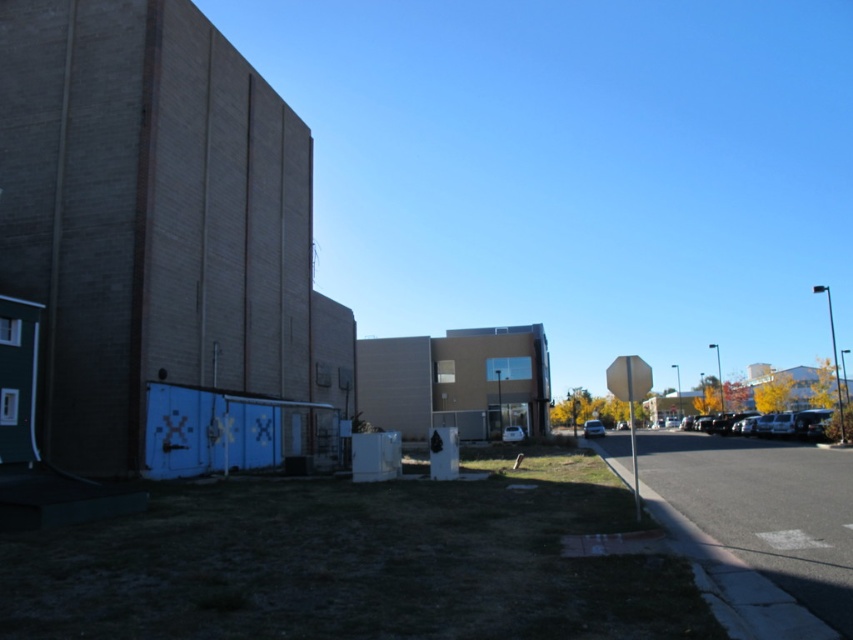
Question: Is metallic silver car at center above shiny silver sedan at center?

Choices:
 (A) no
 (B) yes

Answer: (B)

Question: Which object appears closest to the camera in this image?

Choices:
 (A) metallic silver car at center
 (B) white matte car at center
 (C) shiny silver sedan at center
 (D) metallic silver car at right

Answer: (D)

Question: Can you confirm if metallic silver car at right is smaller than white matte car at center?

Choices:
 (A) yes
 (B) no

Answer: (B)

Question: Is metallic silver car at right to the left of metallic silver car at center from the viewer's perspective?

Choices:
 (A) yes
 (B) no

Answer: (B)

Question: Which point appears closest to the camera in this image?

Choices:
 (A) (624, 422)
 (B) (511, 432)
 (C) (769, 428)

Answer: (C)

Question: Which object is closer to the camera taking this photo?

Choices:
 (A) white matte car at center
 (B) metallic silver car at center

Answer: (A)